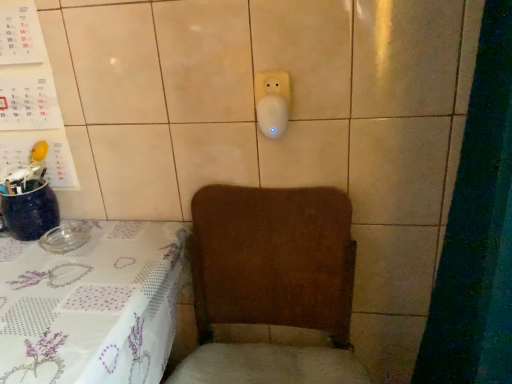
Question: Could white paper calendar at upper left be considered to be inside white printed fabric tablecloth at lower left?

Choices:
 (A) yes
 (B) no

Answer: (B)

Question: From the image's perspective, would you say white printed fabric tablecloth at lower left is shown under white paper calendar at upper left?

Choices:
 (A) no
 (B) yes

Answer: (B)

Question: Does white printed fabric tablecloth at lower left have a greater height compared to white paper calendar at upper left?

Choices:
 (A) no
 (B) yes

Answer: (B)

Question: From a real-world perspective, is white printed fabric tablecloth at lower left physically above white paper calendar at upper left?

Choices:
 (A) no
 (B) yes

Answer: (A)

Question: Can you confirm if white printed fabric tablecloth at lower left is shorter than white paper calendar at upper left?

Choices:
 (A) yes
 (B) no

Answer: (B)

Question: Would you consider white printed fabric tablecloth at lower left to be distant from white paper calendar at upper left?

Choices:
 (A) yes
 (B) no

Answer: (B)

Question: Is brown fabric armchair at lower center closer to camera compared to white printed fabric tablecloth at lower left?

Choices:
 (A) no
 (B) yes

Answer: (B)

Question: Is white printed fabric tablecloth at lower left at the back of brown fabric armchair at lower center?

Choices:
 (A) no
 (B) yes

Answer: (A)

Question: From a real-world perspective, is brown fabric armchair at lower center positioned over white printed fabric tablecloth at lower left based on gravity?

Choices:
 (A) no
 (B) yes

Answer: (B)

Question: Can you confirm if brown fabric armchair at lower center is positioned to the left of white printed fabric tablecloth at lower left?

Choices:
 (A) no
 (B) yes

Answer: (A)

Question: From a real-world perspective, is brown fabric armchair at lower center located beneath white printed fabric tablecloth at lower left?

Choices:
 (A) yes
 (B) no

Answer: (B)

Question: Could you tell me if brown fabric armchair at lower center is facing white printed fabric tablecloth at lower left?

Choices:
 (A) yes
 (B) no

Answer: (B)

Question: Is white paper calendar at upper left surrounding brown fabric armchair at lower center?

Choices:
 (A) no
 (B) yes

Answer: (A)